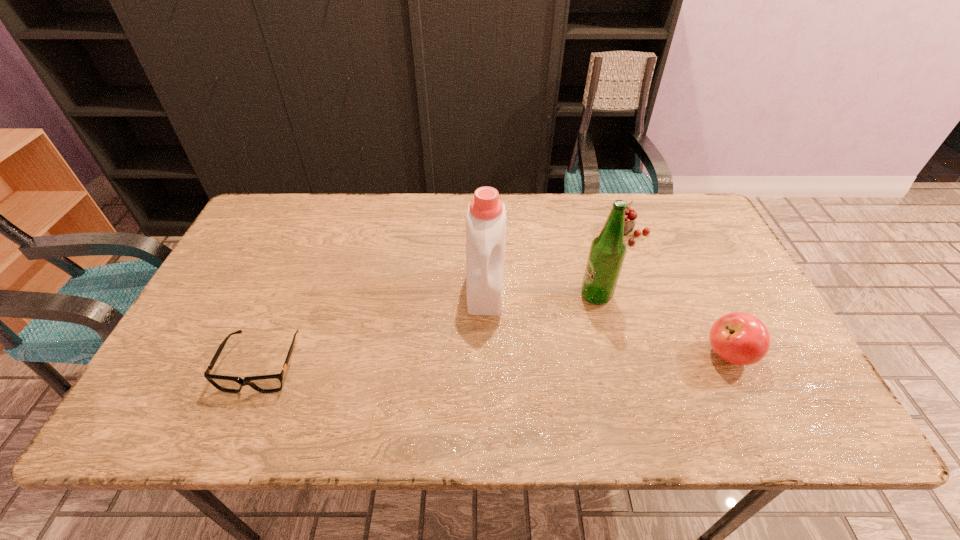
Find the location of `object located at the left edge`. object located at the left edge is located at coordinates (272, 383).

Locate an element on the screen. Image resolution: width=960 pixels, height=540 pixels. object that is at the right edge is located at coordinates (740, 338).

Locate an element on the screen. object that is at the near left corner is located at coordinates (272, 383).

Identify the location of object that is at the near right corner. (740, 338).

This screenshot has height=540, width=960. Find the location of `vacant space at the far edge`. vacant space at the far edge is located at coordinates (355, 221).

Locate an element on the screen. free region at the left edge is located at coordinates (276, 265).

I want to click on free space at the right edge, so click(737, 294).

Where is `vacant space at the far left corner of the desktop`? This screenshot has height=540, width=960. vacant space at the far left corner of the desktop is located at coordinates (282, 220).

The image size is (960, 540). In order to click on free location at the far right corner of the desktop in this screenshot , I will do `click(659, 223)`.

Locate an element on the screen. vacant space that is in between the detergent and the beer bottle is located at coordinates (540, 293).